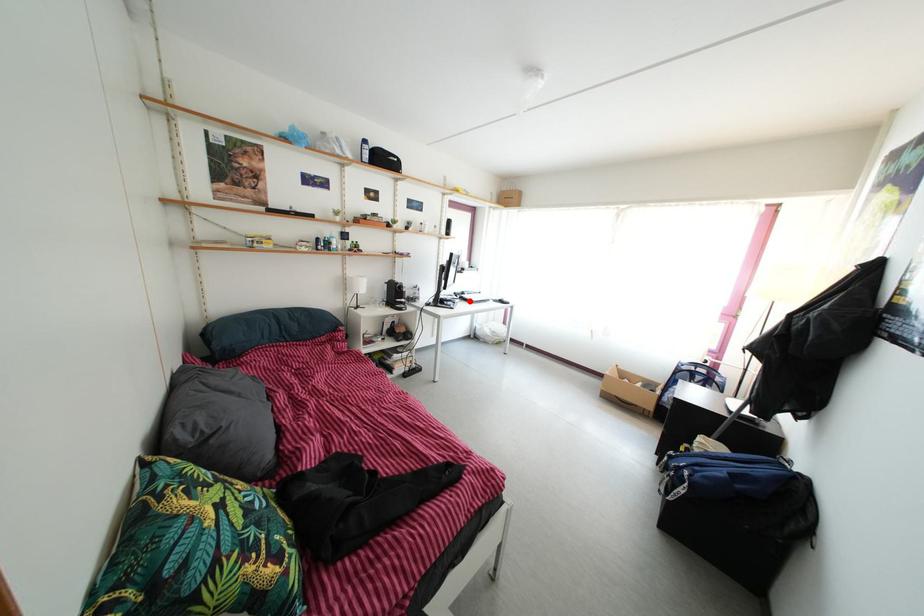
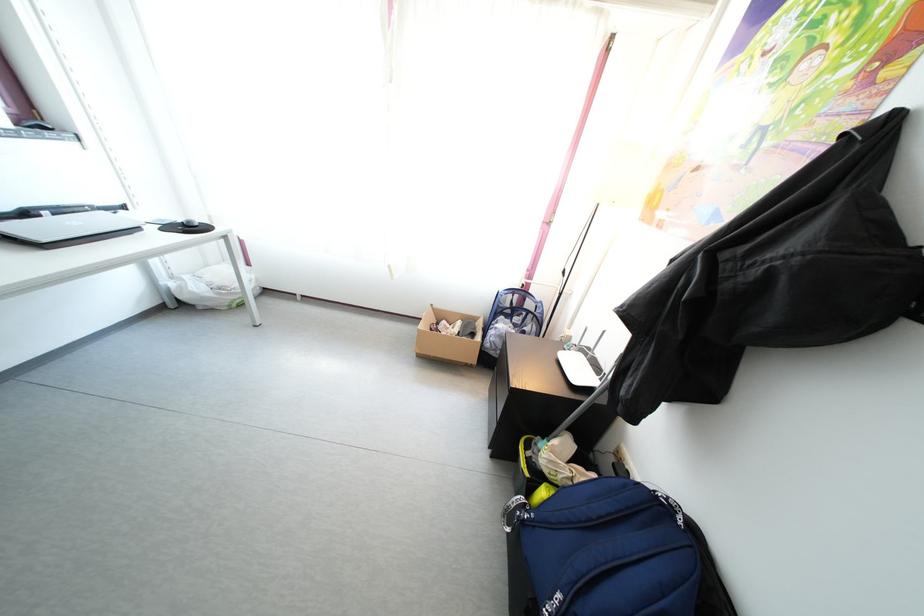
Find the pixel in the second image that matches the highlighted location in the first image.

(31, 222)